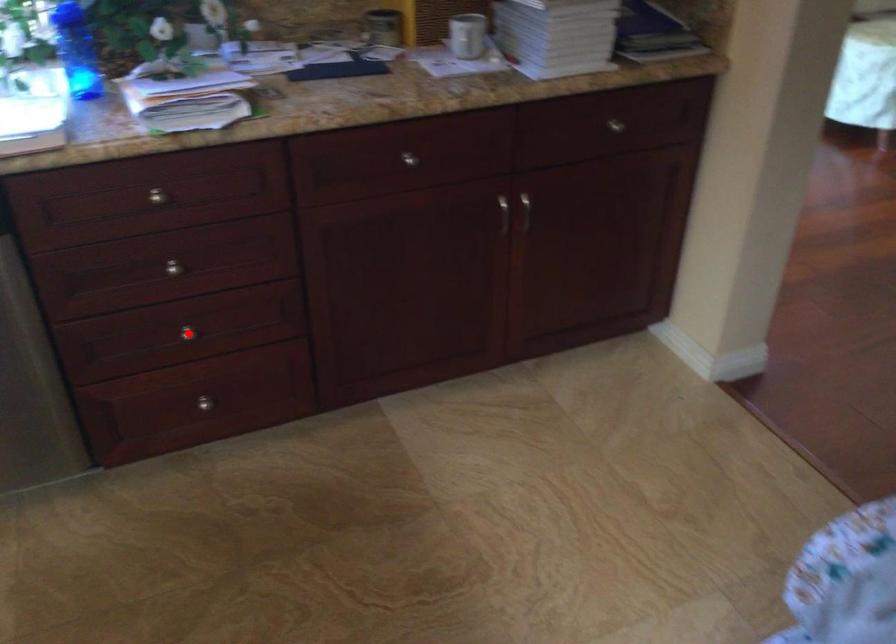
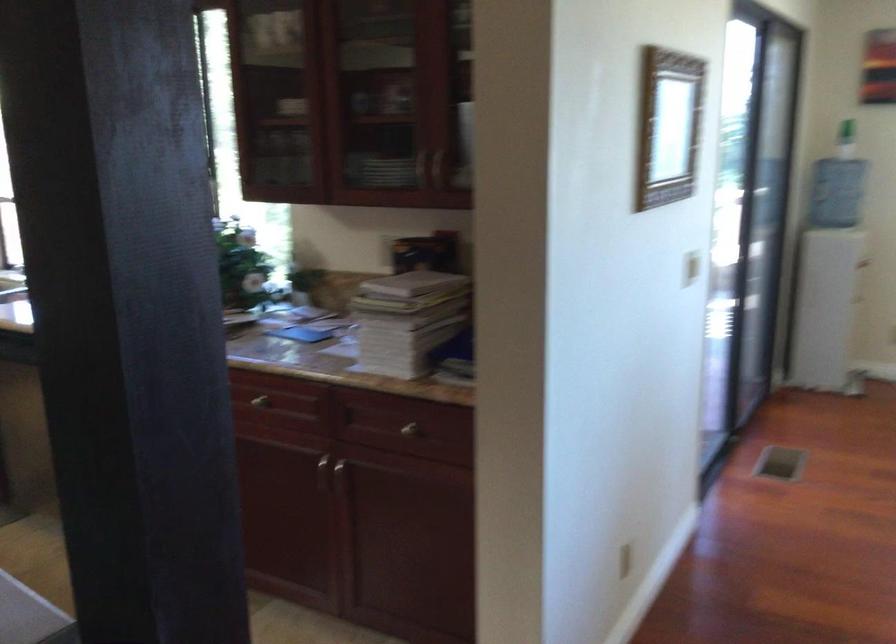
Question: I am providing you with two images of the same scene from different viewpoints. A red point is marked on the first image. At the location where the point appears in image 1, is it still visible in image 2?

Choices:
 (A) Yes
 (B) No

Answer: (B)